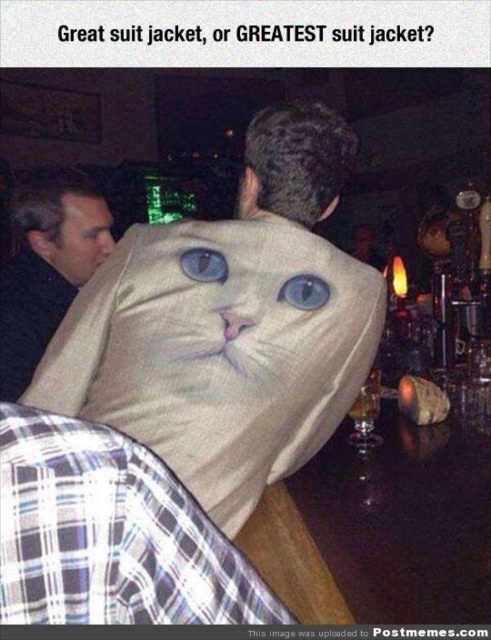
Question: Which object is farther from the camera taking this photo?

Choices:
 (A) matte black jacket at upper left
 (B) matte skin face at upper left

Answer: (B)

Question: Is matte black jacket at upper left closer to camera compared to matte skin face at upper left?

Choices:
 (A) yes
 (B) no

Answer: (A)

Question: Which point is farther to the camera?

Choices:
 (A) matte skin face at upper left
 (B) matte black jacket at upper left

Answer: (A)

Question: Is beige fabric cat at center bigger than matte skin face at upper left?

Choices:
 (A) no
 (B) yes

Answer: (B)

Question: Considering the real-world distances, which object is farthest from the beige fabric cat at center?

Choices:
 (A) matte black jacket at upper left
 (B) matte skin face at upper left

Answer: (B)

Question: Does matte black jacket at upper left appear over matte skin face at upper left?

Choices:
 (A) no
 (B) yes

Answer: (A)